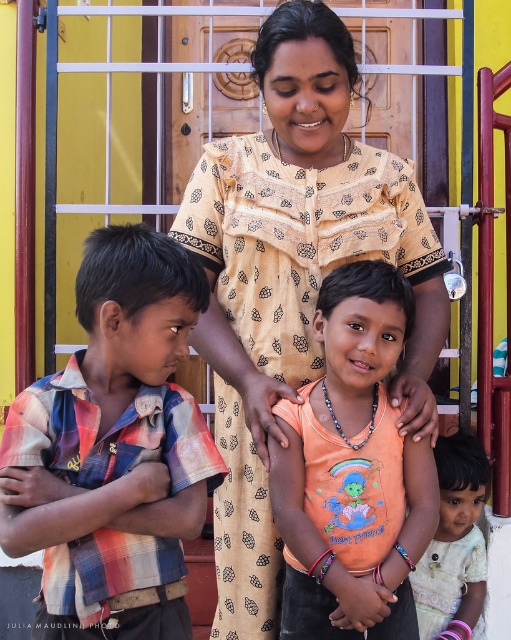
Question: Observing the image, what is the correct spatial positioning of plaid cotton shirt at left in reference to light beige lace dress at lower right?

Choices:
 (A) right
 (B) left

Answer: (B)

Question: Which point is farther to the camera?

Choices:
 (A) (x=331, y=412)
 (B) (x=33, y=531)
 (C) (x=420, y=401)
 (D) (x=479, y=451)

Answer: (D)

Question: Based on their relative distances, which object is nearer to the light beige lace dress at lower right?

Choices:
 (A) orange cotton shirt at center
 (B) plaid cotton shirt at left
 (C) beige printed dress at center

Answer: (A)

Question: Can you confirm if beige printed dress at center is bigger than orange cotton shirt at center?

Choices:
 (A) yes
 (B) no

Answer: (A)

Question: Is the position of orange cotton shirt at center less distant than that of light beige lace dress at lower right?

Choices:
 (A) yes
 (B) no

Answer: (A)

Question: Estimate the real-world distances between objects in this image. Which object is farther from the plaid cotton shirt at left?

Choices:
 (A) beige printed dress at center
 (B) light beige lace dress at lower right
 (C) orange cotton shirt at center

Answer: (B)